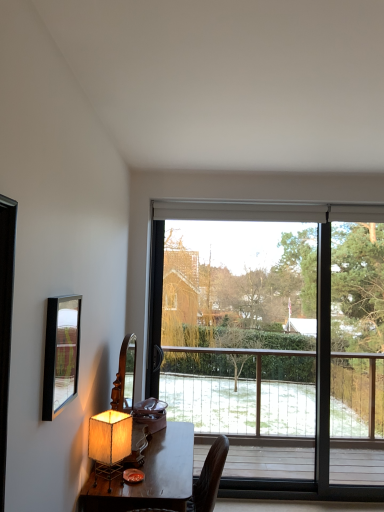
Question: From a real-world perspective, is matte beige lampshade at lower left below transparent glass window at center?

Choices:
 (A) no
 (B) yes

Answer: (B)

Question: Can you confirm if matte beige lampshade at lower left is thinner than transparent glass window at center?

Choices:
 (A) no
 (B) yes

Answer: (A)

Question: Does matte beige lampshade at lower left have a greater height compared to transparent glass window at center?

Choices:
 (A) no
 (B) yes

Answer: (A)

Question: Is matte beige lampshade at lower left to the right of transparent glass window at center from the viewer's perspective?

Choices:
 (A) no
 (B) yes

Answer: (A)

Question: From the image's perspective, is matte beige lampshade at lower left on transparent glass window at center?

Choices:
 (A) yes
 (B) no

Answer: (B)

Question: Considering the positions of transparent glass window at center and wooden desk at lower left in the image, is transparent glass window at center wider or thinner than wooden desk at lower left?

Choices:
 (A) thin
 (B) wide

Answer: (A)

Question: Based on their positions, is transparent glass window at center located to the left or right of wooden desk at lower left?

Choices:
 (A) left
 (B) right

Answer: (B)

Question: Is point (292, 287) closer or farther from the camera than point (125, 507)?

Choices:
 (A) closer
 (B) farther

Answer: (B)

Question: Based on their sizes in the image, would you say transparent glass window at center is bigger or smaller than wooden desk at lower left?

Choices:
 (A) big
 (B) small

Answer: (B)

Question: In terms of width, does matte black mirror at left look wider or thinner when compared to wooden desk at lower left?

Choices:
 (A) thin
 (B) wide

Answer: (A)

Question: Is matte black mirror at left inside or outside of wooden desk at lower left?

Choices:
 (A) outside
 (B) inside

Answer: (A)

Question: Is matte black mirror at left taller or shorter than wooden desk at lower left?

Choices:
 (A) tall
 (B) short

Answer: (B)

Question: From a real-world perspective, is matte black mirror at left above or below wooden desk at lower left?

Choices:
 (A) below
 (B) above

Answer: (B)

Question: Looking at their shapes, would you say wooden desk at lower left is wider or thinner than matte beige lampshade at lower left?

Choices:
 (A) wide
 (B) thin

Answer: (A)

Question: From a real-world perspective, is wooden desk at lower left above or below matte beige lampshade at lower left?

Choices:
 (A) below
 (B) above

Answer: (A)